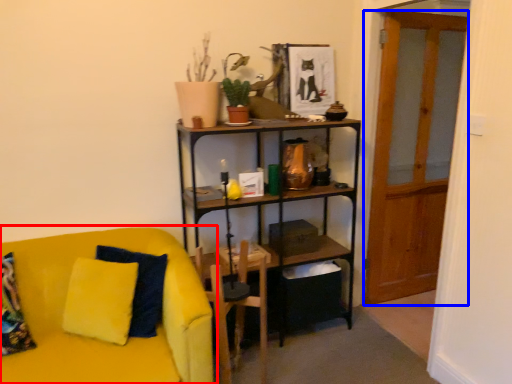
Question: Which of the following is the farthest to the observer, studio couch (highlighted by a red box) or glass door (highlighted by a blue box)?

Choices:
 (A) studio couch
 (B) glass door

Answer: (B)